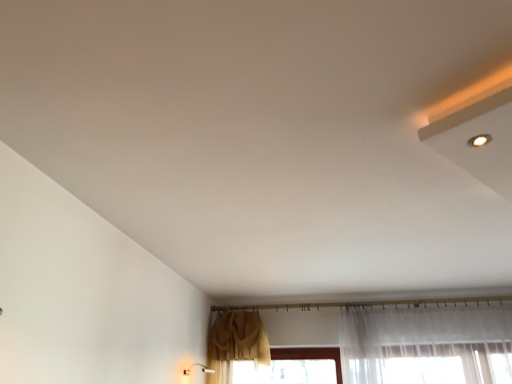
Question: Should I look upward or downward to see white plastic light fixture at lower left?

Choices:
 (A) down
 (B) up

Answer: (A)